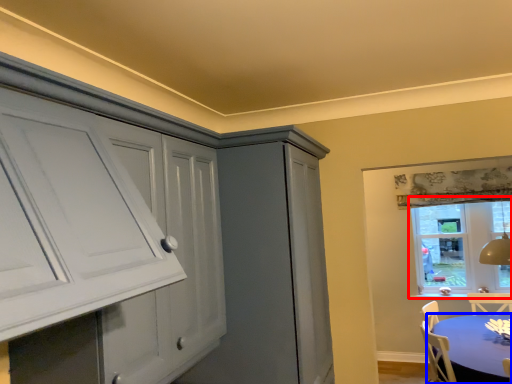
Question: Which point is closer to the camera, window (highlighted by a red box) or table (highlighted by a blue box)?

Choices:
 (A) window
 (B) table

Answer: (B)